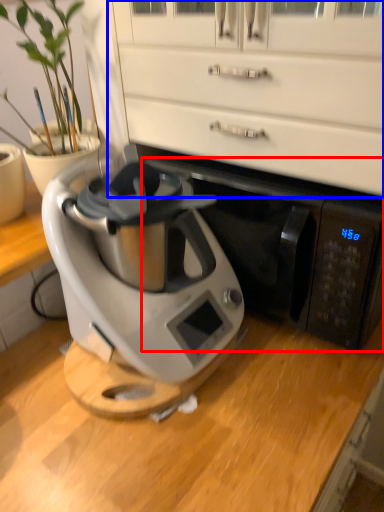
Question: Which object is closer to the camera taking this photo, wide (highlighted by a red box) or dresser (highlighted by a blue box)?

Choices:
 (A) wide
 (B) dresser

Answer: (B)